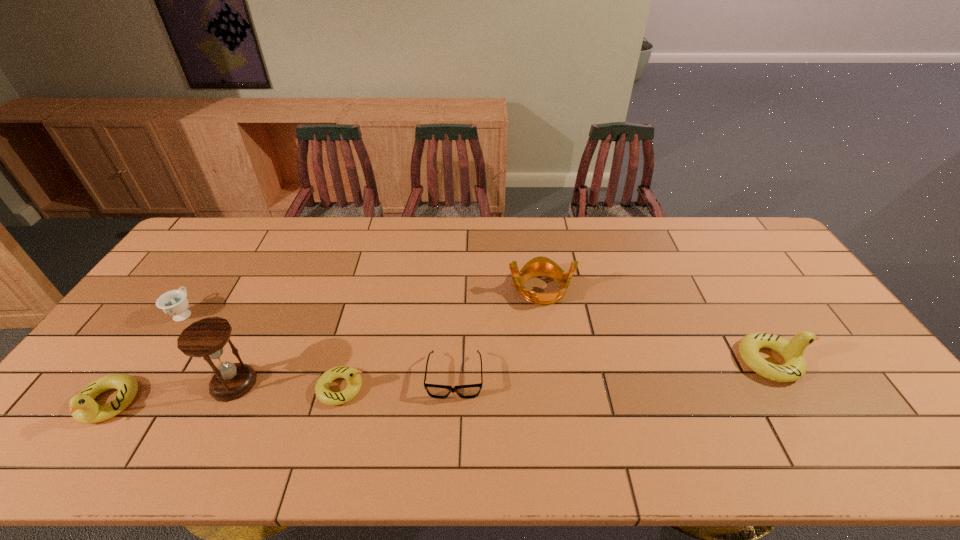
Locate an element on the screen. The height and width of the screenshot is (540, 960). free space at the far right corner is located at coordinates click(768, 252).

Where is `vacant space that is in between the second tallest duckling and the third object from right to left`? The height and width of the screenshot is (540, 960). vacant space that is in between the second tallest duckling and the third object from right to left is located at coordinates (281, 390).

Locate an element on the screen. The image size is (960, 540). free space between the shortest object and the second object from right to left is located at coordinates tap(497, 333).

This screenshot has width=960, height=540. I want to click on vacant region between the fifth object from left to right and the second shortest duckling, so click(x=281, y=390).

Image resolution: width=960 pixels, height=540 pixels. In order to click on free space that is in between the second shortest duckling and the tiara in this screenshot , I will do `click(324, 347)`.

Find the location of a particular element. The height and width of the screenshot is (540, 960). free point between the leftmost duckling and the rightmost object is located at coordinates (440, 382).

Locate an element on the screen. free spot between the second shortest duckling and the hourglass is located at coordinates (171, 393).

At what (x,y) coordinates should I click in order to perform the action: click on empty location between the tallest object and the rightmost duckling. Please return your answer as a coordinate pair (x, y). Looking at the image, I should click on (503, 372).

This screenshot has height=540, width=960. Identify the location of free space between the leftmost duckling and the teacup. (146, 358).

Identify the location of free spot between the leftmost duckling and the sunglasses. The height and width of the screenshot is (540, 960). (281, 390).